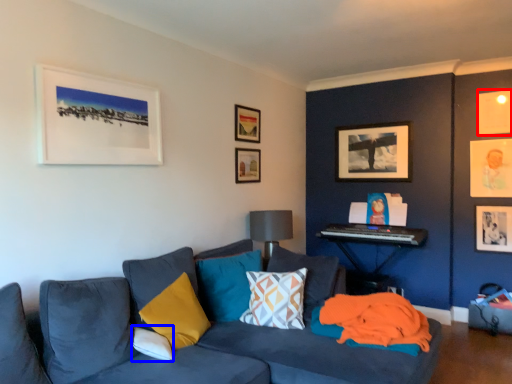
Question: Which point is further to the camera, picture frame (highlighted by a red box) or pillow (highlighted by a blue box)?

Choices:
 (A) picture frame
 (B) pillow

Answer: (A)